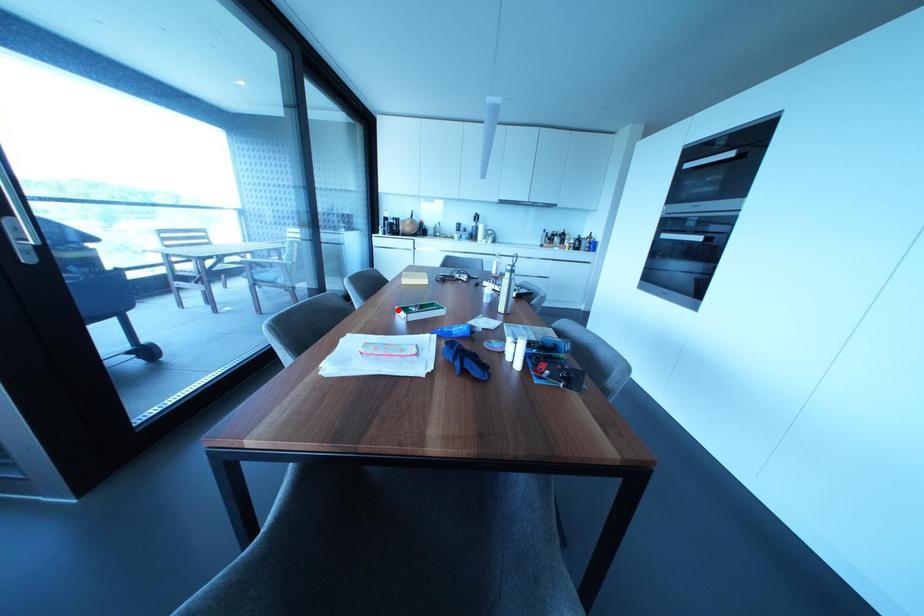
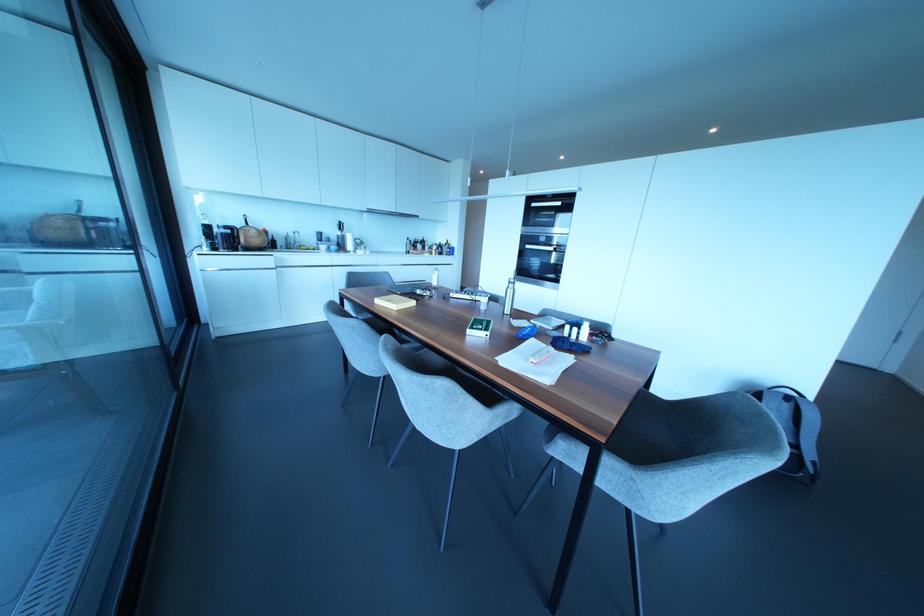
Where in the second image is the point corresponding to the highlighted location from the first image?

(468, 331)